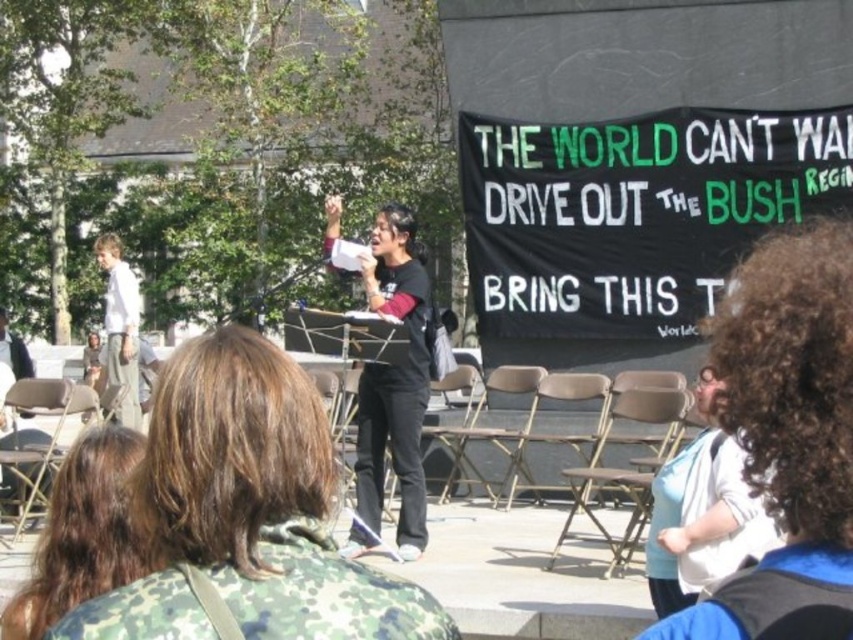
You are part of the crowd at the protest and want to hand a flyer to the person wearing the camouflage jacket at center. Based on the speaker and the banner, where should you go to find them?

The camouflage jacket at center is located at point (82, 532), which is near the central figure speaking into a megaphone. You should approach the speaker area to find them.